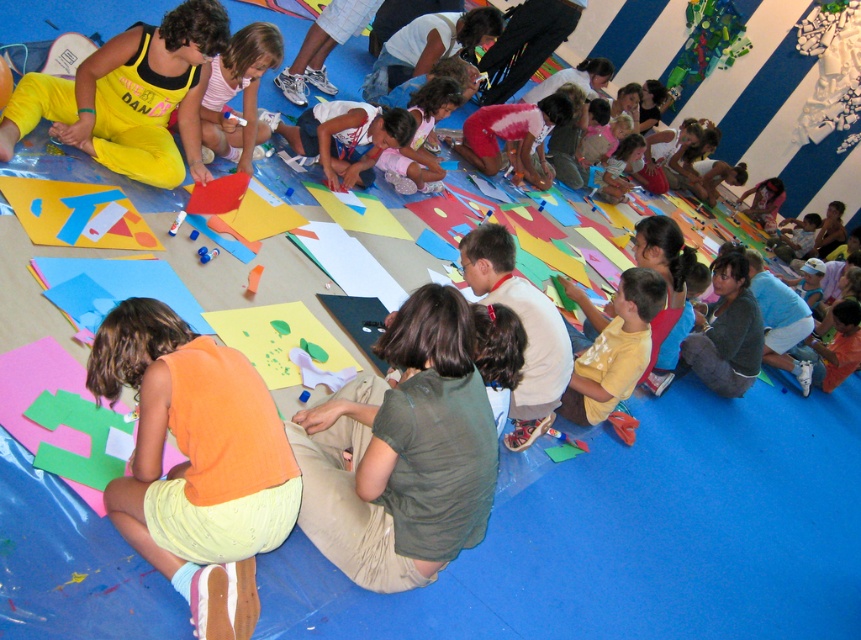
You are standing in the classroom and want to walk towards the point that is closer to you. Which point should you head towards, point (77, 108) or point (225, 156)?

You should head towards point (77, 108) because it is closer to the viewer than point (225, 156).

Looking at this image, you are standing in the middle of the room and want to move towards the velvet yellow pants at left. Which direction should you walk to reach them?

You should walk towards the left side of the room to reach the velvet yellow pants at left since their 2D location is at point (129,97), which is positioned to the left relative to your central position.

You are a photographer trying to capture a candid shot of the orange cotton shirt at lower left and the pink fabric shirt at center. Since you want to frame both in the same shot, which direction should you move your camera to include both shirts in the frame?

The orange cotton shirt at lower left is to the right of the pink fabric shirt at center, so you should move your camera to the left to include both shirts in the frame.